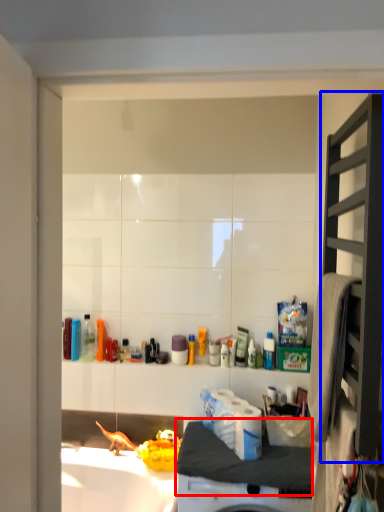
Question: Which object appears closest to the camera in this image, counter top (highlighted by a red box) or shelf (highlighted by a blue box)?

Choices:
 (A) counter top
 (B) shelf

Answer: (B)